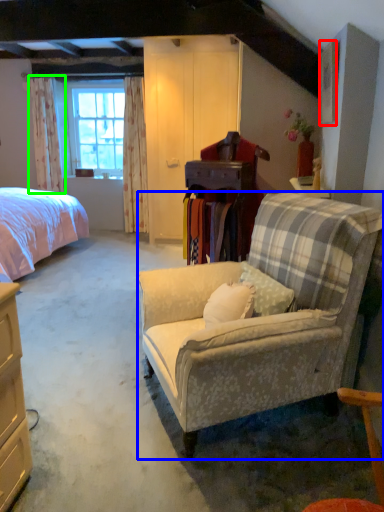
Question: Which is farther away from picture frame (highlighted by a red box)? studio couch (highlighted by a blue box) or curtain (highlighted by a green box)?

Choices:
 (A) studio couch
 (B) curtain

Answer: (B)